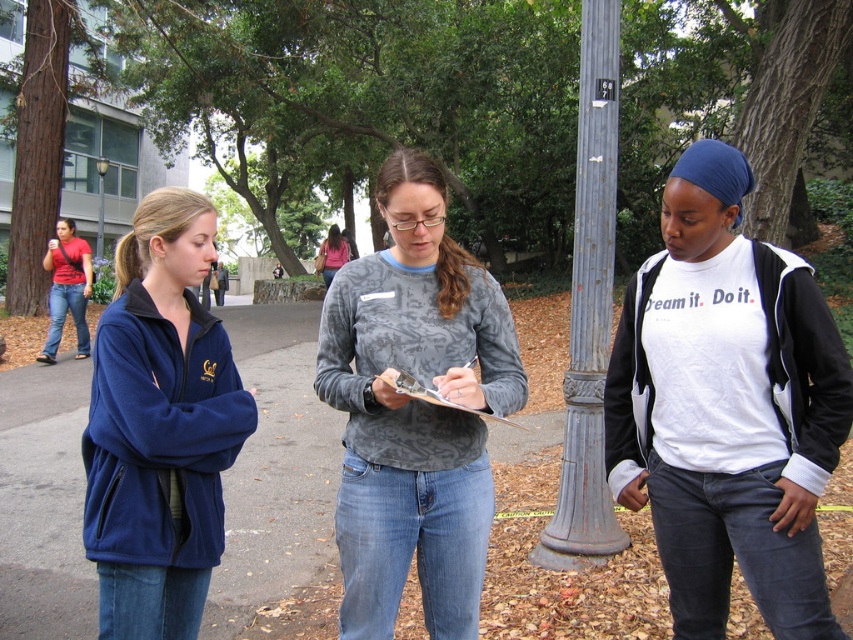
You are standing at the point labeled point (173, 216) and want to walk towards the point labeled point (566, 497). Which direction should you move?

You should move away from the camera because point (566, 497) is further away than point (173, 216).

You are a photographer standing on the pathway and want to take a photo that includes both the gray textured sweatshirt at center and the brushed metal lamp post at upper center. Based on their positions, where should you position the lamp post in the frame relative to the sweatshirt?

The gray textured sweatshirt at center is located below the brushed metal lamp post at upper center, so to include both in the photo, position the lamp post higher in the frame above the gray textured sweatshirt at center.

You are standing at the point with coordinates point (97, 170) and want to walk towards the point with coordinates point (322, 307). Which direction should you move?

Since point (322, 307) is closer to the viewer than point (97, 170), you should move forward towards it.